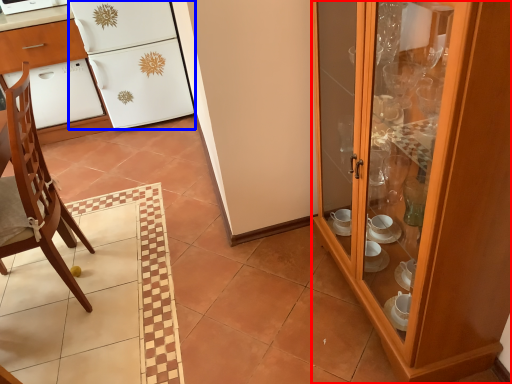
Question: Which point is closer to the camera, cabinetry (highlighted by a red box) or refrigerator (highlighted by a blue box)?

Choices:
 (A) cabinetry
 (B) refrigerator

Answer: (A)